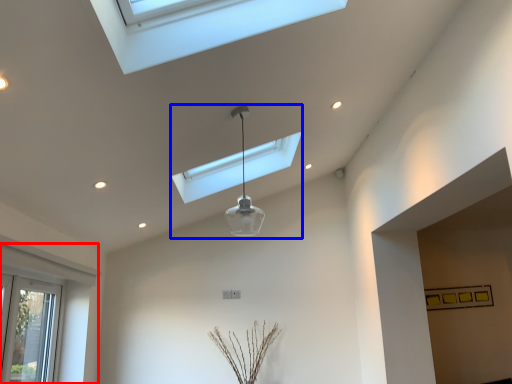
Question: Which object is further to the camera taking this photo, window (highlighted by a red box) or lamp (highlighted by a blue box)?

Choices:
 (A) window
 (B) lamp

Answer: (B)